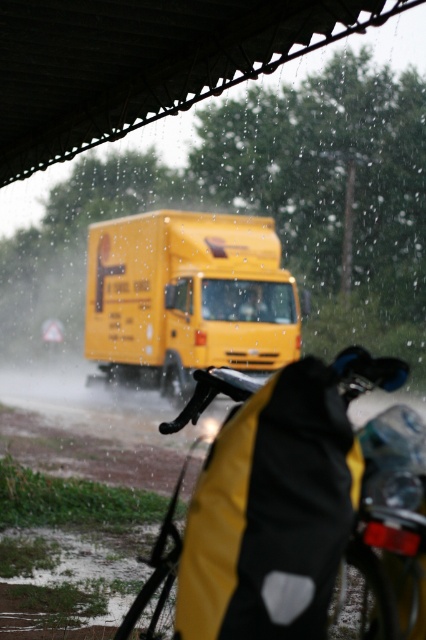
Where is `yellow matte bag at lower center`? This screenshot has height=640, width=426. yellow matte bag at lower center is located at coordinates (296, 509).

Does yellow matte bag at lower center have a lesser width compared to yellow matte truck at center?

Correct, yellow matte bag at lower center's width is less than yellow matte truck at center's.

Is point (271, 621) closer to viewer compared to point (207, 300)?

Yes, it is.

Find the location of a particular element. The height and width of the screenshot is (640, 426). yellow matte bag at lower center is located at coordinates (296, 509).